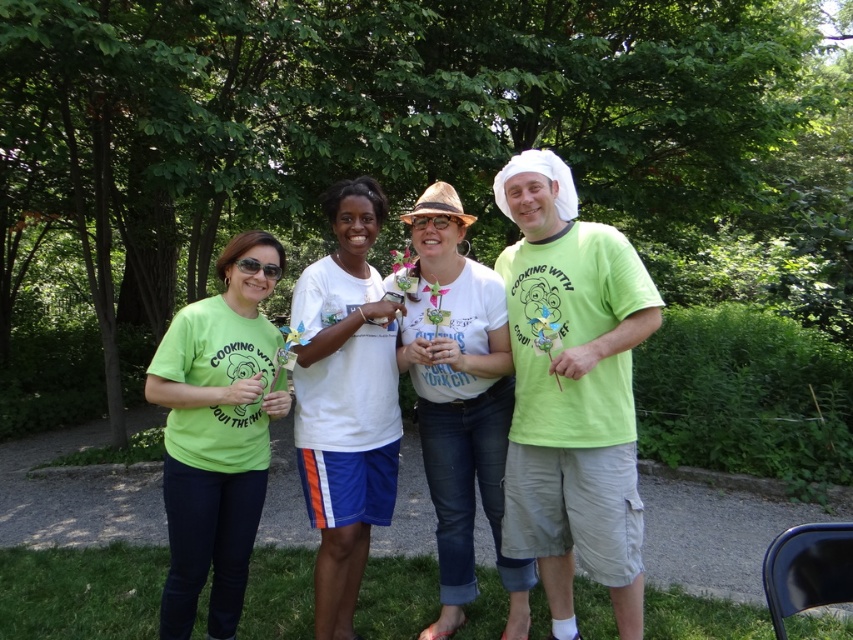
Question: Is matte green t-shirt at left below white matte hat at center?

Choices:
 (A) yes
 (B) no

Answer: (A)

Question: Does matte green t-shirt at left have a smaller size compared to white cotton shirt at center?

Choices:
 (A) yes
 (B) no

Answer: (B)

Question: Which of these objects is positioned farthest from the matte green t-shirt at left?

Choices:
 (A) white cotton shirt at center
 (B) green matte t-shirt at center
 (C) matte green t-shirt at center
 (D) white matte hat at center

Answer: (B)

Question: From the image, what is the correct spatial relationship of green matte t-shirt at center in relation to matte green t-shirt at left?

Choices:
 (A) above
 (B) below

Answer: (A)

Question: Which of the following is the closest to the observer?

Choices:
 (A) (618, 401)
 (B) (378, 397)

Answer: (A)

Question: Which object is the closest to the matte green t-shirt at center?

Choices:
 (A) matte green t-shirt at left
 (B) green matte t-shirt at center
 (C) white matte hat at center
 (D) white cotton shirt at center

Answer: (B)